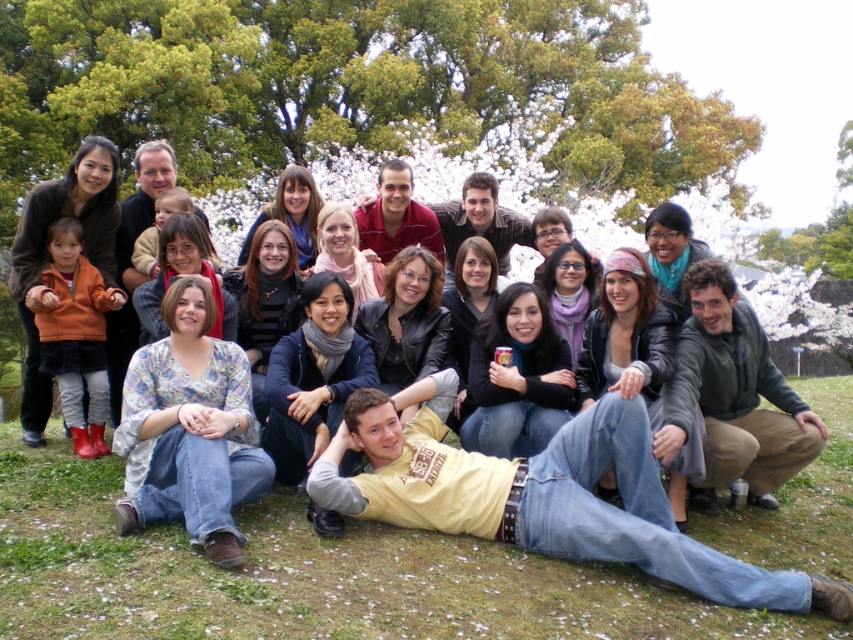
You are taking a photo of the group in the park. You notice two points in the image labeled as point 1 at position [616,620] and point 2 at position [30,196]. Which point is closer to the camera?

Point 1 at position [616,620] is closer to the camera than point 2 at position [30,196].

You are planning to place a small picnic basket on the green grass at lower center. The basket is 0.5 meters wide. Can the orange fleece jacket at left be placed next to it without overlapping?

The green grass at lower center might be wider than orange fleece jacket at left, so there is a possibility that the jacket can be placed next to the basket without overlapping, but the exact width of the grass is not specified. Please ensure there is enough space before placing them.